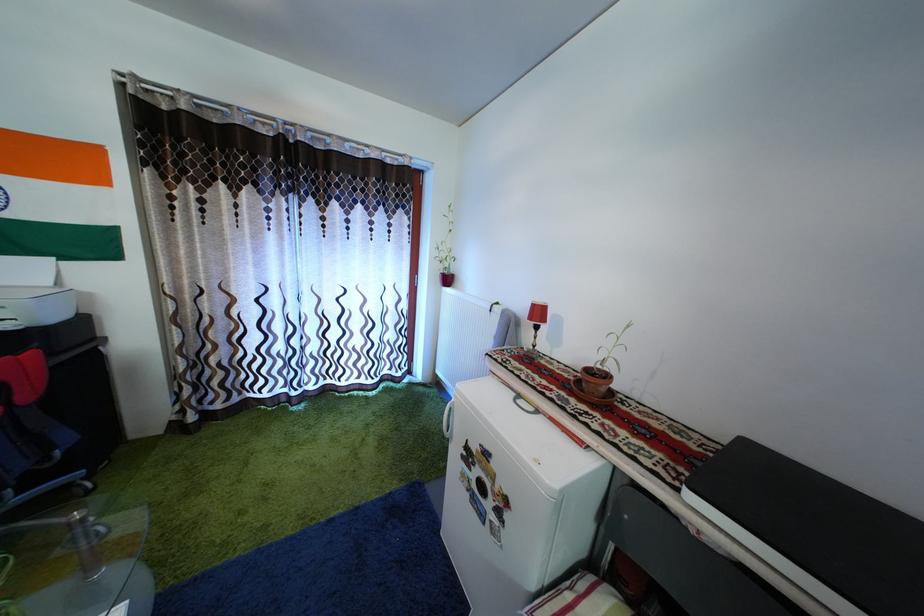
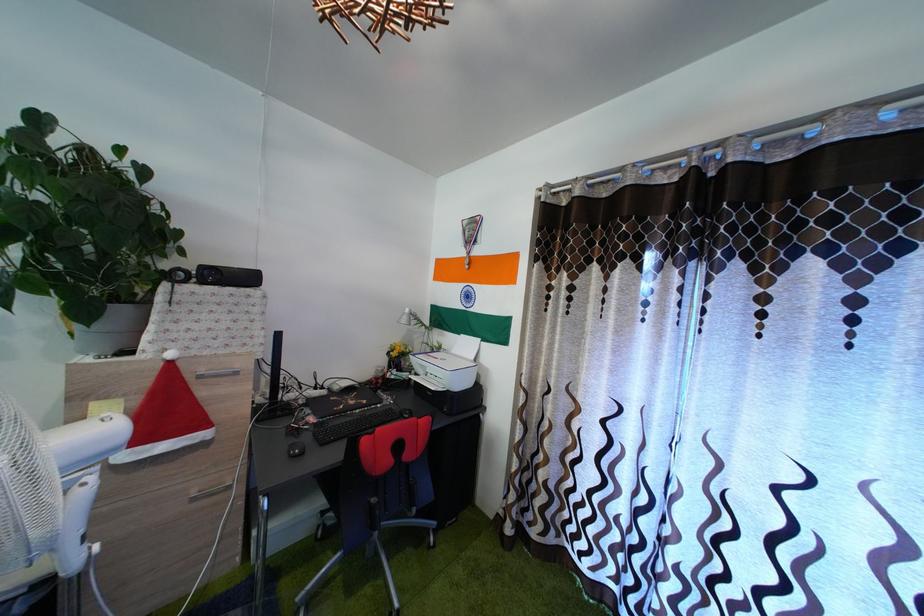
Question: The images are taken continuously from a first-person perspective. In which direction is your viewpoint rotating?

Choices:
 (A) Left
 (B) Right
 (C) Up
 (D) Down

Answer: (A)